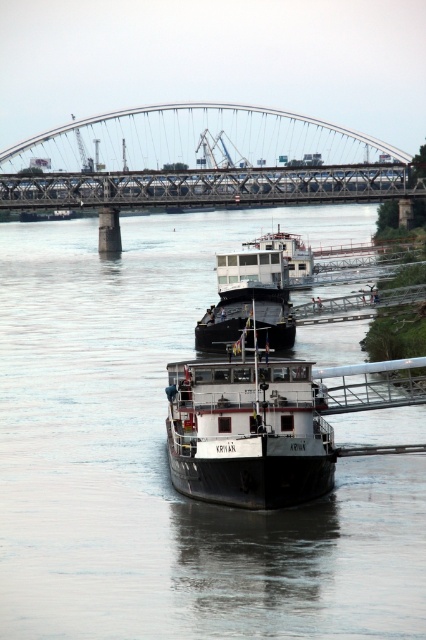
You are standing at the point marked as point (x=301, y=580) on the map. There are two boats visible in the scene. The smaller boat is the KRIVAN, and the larger one is a cargo ship. How far apart are these two boats from each other?

The two boats are 228.75 feet apart.

You are a river traffic controller observing the scene. The smaller boat named KRIVAN is approaching the bridge. There is a black matte barge at center. Based on their positions, which vessel is closer to the bridge?

The black matte barge at center is located at point (x=166, y=460), so it is closer to the bridge than the KRIVAN boat.